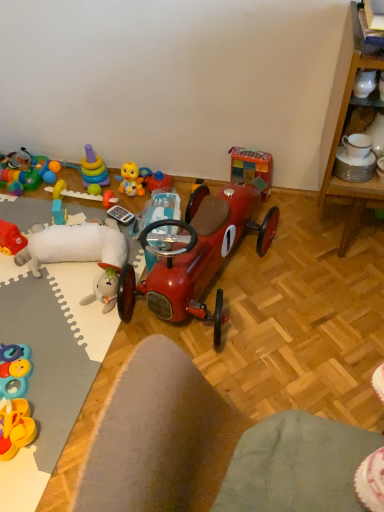
How much space does rubber duck at lower left, which is counted as the 7th toy, starting from the right, occupy vertically?

The height of rubber duck at lower left, which is counted as the 7th toy, starting from the right, is 4.69 inches.

Describe the element at coordinates (82, 194) in the screenshot. The image size is (384, 512). I see `rubberized plastic toy at center, which is the 6th toy in right-to-left order` at that location.

You are a GUI agent. You are given a task and a screenshot of the screen. Output one action in this format:
    pyautogui.click(x=<x>, y=<y>)
    Task: Click on the matte plastic desk at center
    This screenshot has width=384, height=512.
    Given the screenshot: What is the action you would take?
    pyautogui.click(x=208, y=446)

In order to face matte plastic desk at center, should I rotate leftwards or rightwards?

Rotate right and turn 13.469 degrees.

What is the approximate height of wooden table at lower center?

1.59 inches.

In order to click on rubberized green ball at center, the fifth toy positioned from the right in this screenshot , I will do `click(94, 189)`.

How many degrees apart are the facing directions of wooden cabinet at right and wooden table at lower center?

The angle between the facing direction of wooden cabinet at right and the facing direction of wooden table at lower center is 90.8 degrees.

Which of these two, wooden cabinet at right or wooden table at lower center, stands taller?

Standing taller between the two is wooden cabinet at right.

Is wooden table at lower center surrounded by wooden cabinet at right?

No, wooden table at lower center is not inside wooden cabinet at right.

Is wooden cabinet at right looking in the opposite direction of wooden table at lower center?

No, wooden cabinet at right is not facing the opposite direction of wooden table at lower center.

Can you confirm if rubber duck at lower left, which ranks as the fifth toy in left-to-right order, is positioned to the right of shiny metallic car at center, placed as the third toy when sorted from right to left?

In fact, rubber duck at lower left, which ranks as the fifth toy in left-to-right order, is to the left of shiny metallic car at center, placed as the third toy when sorted from right to left.

From a real-world perspective, who is located lower, rubber duck at lower left, which is counted as the 7th toy, starting from the right, or shiny metallic car at center, the 9th toy positioned from the left?

rubber duck at lower left, which is counted as the 7th toy, starting from the right, is physically lower.

Can you confirm if rubber duck at lower left, which is counted as the 7th toy, starting from the right, is wider than shiny metallic car at center, placed as the third toy when sorted from right to left?

→ Yes, rubber duck at lower left, which is counted as the 7th toy, starting from the right, is wider than shiny metallic car at center, placed as the third toy when sorted from right to left.

Considering the points (13, 358) and (158, 216), which point is in front, point (13, 358) or point (158, 216)?

Positioned in front is point (13, 358).

Is point (0, 227) positioned in front of point (127, 185)?

Yes, it is.

Considering the sizes of objects rubber duck at left, marked as the 10th toy in a right-to-left arrangement, and yellow rubber duck at upper center, marked as the fourth toy in a right-to-left arrangement, in the image provided, who is thinner, rubber duck at left, marked as the 10th toy in a right-to-left arrangement, or yellow rubber duck at upper center, marked as the fourth toy in a right-to-left arrangement,?

yellow rubber duck at upper center, marked as the fourth toy in a right-to-left arrangement, is thinner.

Is yellow rubber duck at upper center, marked as the fourth toy in a right-to-left arrangement, at the back of rubber duck at left, which is counted as the second toy, starting from the left?

No, rubber duck at left, which is counted as the second toy, starting from the left, is not facing the opposite direction of yellow rubber duck at upper center, marked as the fourth toy in a right-to-left arrangement.

Is rubber duck at left, marked as the 10th toy in a right-to-left arrangement, shorter than yellow rubber duck at upper center, acting as the 8th toy starting from the left?

Indeed, rubber duck at left, marked as the 10th toy in a right-to-left arrangement, has a lesser height compared to yellow rubber duck at upper center, acting as the 8th toy starting from the left.

Is point (47, 175) less distant than point (92, 191)?

No, (47, 175) is behind (92, 191).

Which is more to the left, rubberized multicolored ball at left, acting as the 1th toy starting from the left, or rubberized green ball at center, the 7th toy in the left-to-right sequence?

rubberized multicolored ball at left, acting as the 1th toy starting from the left.

In the scene shown: Is rubberized multicolored ball at left, which is counted as the 11th toy, starting from the right, inside or outside of rubberized green ball at center, the 7th toy in the left-to-right sequence?

rubberized multicolored ball at left, which is counted as the 11th toy, starting from the right, lies outside rubberized green ball at center, the 7th toy in the left-to-right sequence.

Considering the relative sizes of rubber duck at lower left, which is counted as the 7th toy, starting from the right, and rubberized multicolored ball at left, which is counted as the 11th toy, starting from the right, in the image provided, is rubber duck at lower left, which is counted as the 7th toy, starting from the right, wider than rubberized multicolored ball at left, which is counted as the 11th toy, starting from the right,?

Yes.

Is point (34, 438) behind point (45, 172)?

No, it is not.

Which object is closer to the camera, rubber duck at lower left, which is counted as the 7th toy, starting from the right, or rubberized multicolored ball at left, which is counted as the 11th toy, starting from the right?

rubber duck at lower left, which is counted as the 7th toy, starting from the right, is closer to the camera.

Is shiny metallic car at center, the 9th toy positioned from the left, shorter than rubberized multicolored ball at left, acting as the 1th toy starting from the left?

No.

Considering the positions of objects shiny metallic car at center, placed as the third toy when sorted from right to left, and rubberized multicolored ball at left, acting as the 1th toy starting from the left, in the image provided, who is behind, shiny metallic car at center, placed as the third toy when sorted from right to left, or rubberized multicolored ball at left, acting as the 1th toy starting from the left,?

rubberized multicolored ball at left, acting as the 1th toy starting from the left, is further away from the camera.

Between shiny metallic car at center, placed as the third toy when sorted from right to left, and rubberized multicolored ball at left, which is counted as the 11th toy, starting from the right, which one has larger width?

With larger width is rubberized multicolored ball at left, which is counted as the 11th toy, starting from the right.

From the image's perspective, would you say shiny metallic car at center, placed as the third toy when sorted from right to left, is positioned over rubberized multicolored ball at left, acting as the 1th toy starting from the left?

No, from the image's perspective, shiny metallic car at center, placed as the third toy when sorted from right to left, is not on top of rubberized multicolored ball at left, acting as the 1th toy starting from the left.

Based on their sizes in the image, would you say rubber duck at lower left, which ranks as the fifth toy in left-to-right order, is bigger or smaller than rubberized plastic toy at center, which is the 6th toy in right-to-left order?

rubber duck at lower left, which ranks as the fifth toy in left-to-right order, is bigger than rubberized plastic toy at center, which is the 6th toy in right-to-left order.

Is rubber duck at lower left, which is counted as the 7th toy, starting from the right, at the right side of rubberized plastic toy at center, placed as the 6th toy when sorted from left to right?

No, rubber duck at lower left, which is counted as the 7th toy, starting from the right, is not to the right of rubberized plastic toy at center, placed as the 6th toy when sorted from left to right.

The width and height of the screenshot is (384, 512). Identify the location of the 6th toy below when counting from the rubberized plastic toy at center, which is the 6th toy in right-to-left order (from the image's perspective). (15, 400).

How distant is rubber duck at lower left, which is counted as the 7th toy, starting from the right, from rubberized plastic toy at center, placed as the 6th toy when sorted from left to right?

They are 85.75 centimeters apart.

I want to click on cabinetry that appears in front of the wooden table at lower center, so click(341, 136).

From the image's perspective, starting from the shiny metallic car at center, placed as the third toy when sorted from right to left, which toy is the 4th one below? Please provide its 2D coordinates.

[(15, 400)]

Based on their spatial positions, is yellow rubber duck at upper center, marked as the fourth toy in a right-to-left arrangement, or translucent plastic block at upper left, the 3th toy positioned from the left, further from rubberized green ball at center, the fifth toy positioned from the right?

Based on the image, translucent plastic block at upper left, the 3th toy positioned from the left, appears to be further to rubberized green ball at center, the fifth toy positioned from the right.

Looking at the image, which one is located closer to matte plastic desk at center, wooden block tower at upper right, the first toy in the right-to-left sequence, or rubberized multicolored ball at left, acting as the 1th toy starting from the left?

Among the two, wooden block tower at upper right, the first toy in the right-to-left sequence, is located nearer to matte plastic desk at center.

When comparing their distances from wooden table at lower center, does wooden block tower at upper right, the eleventh toy viewed from the left, or rubberized green ball at center, the fifth toy positioned from the right, seem further?

Based on the image, wooden block tower at upper right, the eleventh toy viewed from the left, appears to be further to wooden table at lower center.

Looking at the image, which one is located closer to rubberized plastic rings at lower left, the eighth toy viewed from the right, shiny red car at center, the second toy from the right, or wooden cabinet at right?

shiny red car at center, the second toy from the right, is closer to rubberized plastic rings at lower left, the eighth toy viewed from the right.

Which object lies further to the anchor point wooden table at lower center, matte plastic desk at center or rubberized green ball at center, the fifth toy positioned from the right?

matte plastic desk at center is positioned further to the anchor wooden table at lower center.

Looking at the image, which one is located closer to translucent plastic block at upper left, which is the 9th toy in right-to-left order, matte plastic desk at center or rubber duck at left, which is counted as the second toy, starting from the left?

The object closer to translucent plastic block at upper left, which is the 9th toy in right-to-left order, is rubber duck at left, which is counted as the second toy, starting from the left.

Based on their spatial positions, is wooden block tower at upper right, the eleventh toy viewed from the left, or rubber duck at left, marked as the 10th toy in a right-to-left arrangement, further from rubberized green ball at center, the fifth toy positioned from the right?

Based on the image, wooden block tower at upper right, the eleventh toy viewed from the left, appears to be further to rubberized green ball at center, the fifth toy positioned from the right.

Looking at the image, which one is located further to wooden cabinet at right, wooden table at lower center or matte plastic desk at center?

matte plastic desk at center lies further to wooden cabinet at right than the other object.

The width and height of the screenshot is (384, 512). What are the coordinates of `toy between wooden table at lower center and rubber duck at lower left, which is counted as the 7th toy, starting from the right, from top to bottom` in the screenshot? It's located at (14, 370).

You are a GUI agent. You are given a task and a screenshot of the screen. Output one action in this format:
    pyautogui.click(x=<x>, y=<y>)
    Task: Click on the desk situated between wooden table at lower center and wooden cabinet at right from left to right
    The height and width of the screenshot is (512, 384).
    Given the screenshot: What is the action you would take?
    pyautogui.click(x=208, y=446)

The height and width of the screenshot is (512, 384). I want to click on table situated between rubberized multicolored ball at left, acting as the 1th toy starting from the left, and wooden block tower at upper right, the eleventh toy viewed from the left, from left to right, so click(82, 308).

Find the location of `cabinetry positioned between matte plastic desk at center and wooden block tower at upper right, the eleventh toy viewed from the left, from near to far`. cabinetry positioned between matte plastic desk at center and wooden block tower at upper right, the eleventh toy viewed from the left, from near to far is located at coordinates (341, 136).